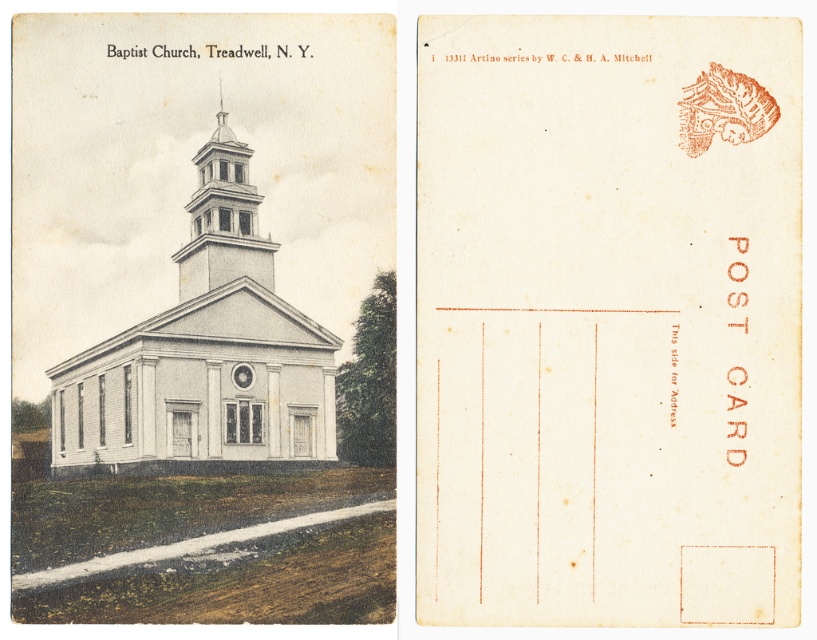
From the picture: You are designing a layout for a new postcard and want to ensure the white paper at center and the white wood church at center are both visible. Given their sizes, which object should you prioritize placing first to ensure both fit?

The white paper at center occupies less space than the white wood church at center, so you should prioritize placing the white wood church at center first to ensure it fits, then arrange the smaller white paper at center around it.

You are an architect examining the vintage postcard of the Baptist Church in Treadwell, New York. You notice the white wood church at center and the white wood tower at center. Which structure has a greater width according to the illustration?

The white wood church at center has a greater width than the white wood tower at center.